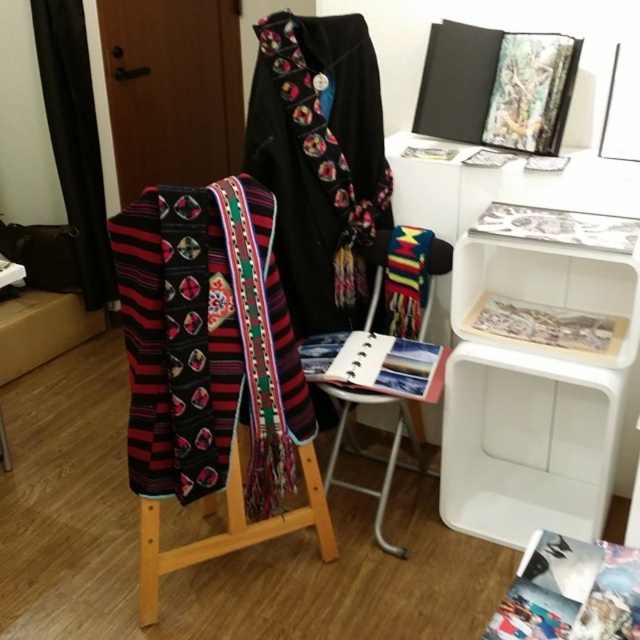
You are an interior designer arranging a display in a room. You have an embroidered wool scarf at center. Where should you place it to ensure it aligns with the existing display setup described in the scene?

The embroidered wool scarf at center should be placed at point (208,342) as specified in the Objects Description to align with the existing display setup.

You are a delivery person who needs to place a small package between the embroidered wool scarf at center and the wooden stool at center. Can you fit it there?

The distance between the embroidered wool scarf at center and the wooden stool at center is 8.30 inches, so the small package can fit as long as its length is less than 8.30 inches.